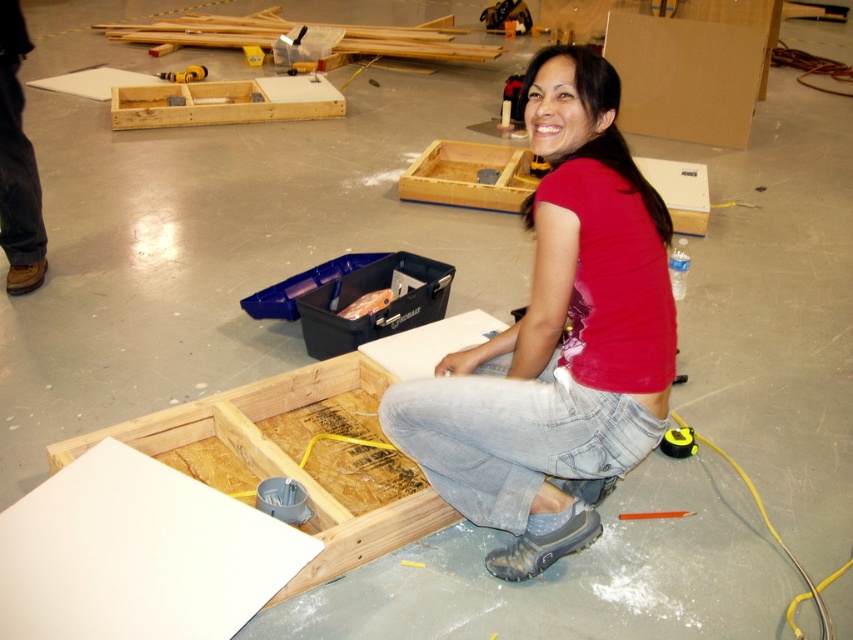
Who is shorter, black plastic toolbox at center or yellow plastic tape measure at center?

yellow plastic tape measure at center is shorter.

Can you confirm if black plastic toolbox at center is positioned to the left of yellow plastic tape measure at center?

No, black plastic toolbox at center is not to the left of yellow plastic tape measure at center.

The height and width of the screenshot is (640, 853). I want to click on black plastic toolbox at center, so click(x=376, y=308).

You are a GUI agent. You are given a task and a screenshot of the screen. Output one action in this format:
    pyautogui.click(x=<x>, y=<y>)
    Task: Click on the black plastic toolbox at center
    This screenshot has height=640, width=853.
    Given the screenshot: What is the action you would take?
    pyautogui.click(x=376, y=308)

Can you confirm if red matte shirt at center is shorter than wooden planks at upper center?

No.

Does red matte shirt at center appear under wooden planks at upper center?

Indeed, red matte shirt at center is positioned under wooden planks at upper center.

Does point (537, 451) lie in front of point (426, 24)?

That is True.

You are a GUI agent. You are given a task and a screenshot of the screen. Output one action in this format:
    pyautogui.click(x=<x>, y=<y>)
    Task: Click on the red matte shirt at center
    The width and height of the screenshot is (853, 640).
    Given the screenshot: What is the action you would take?
    pyautogui.click(x=556, y=339)

Consider the image. Is wooden planks at upper center bigger than woodenmaterial/texture at upper center?

Indeed, wooden planks at upper center has a larger size compared to woodenmaterial/texture at upper center.

The width and height of the screenshot is (853, 640). What are the coordinates of `wooden planks at upper center` in the screenshot? It's located at (204, 29).

Who is more distant from viewer, (248, 24) or (206, 83)?

Point (248, 24)

The image size is (853, 640). I want to click on wooden planks at upper center, so point(204,29).